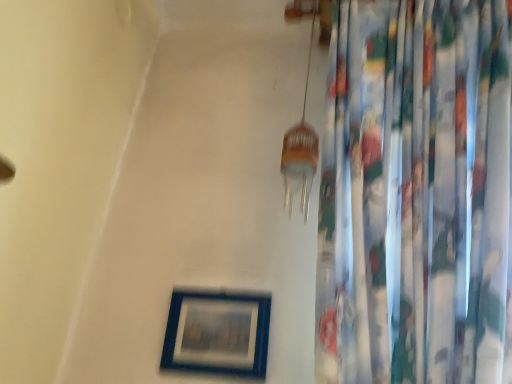
This screenshot has height=384, width=512. What do you see at coordinates (217, 333) in the screenshot?
I see `wooden framed picture at lower center` at bounding box center [217, 333].

This screenshot has width=512, height=384. Find the location of `wooden framed picture at lower center`. wooden framed picture at lower center is located at coordinates 217,333.

Where is `wooden framed picture at lower center`? wooden framed picture at lower center is located at coordinates (217, 333).